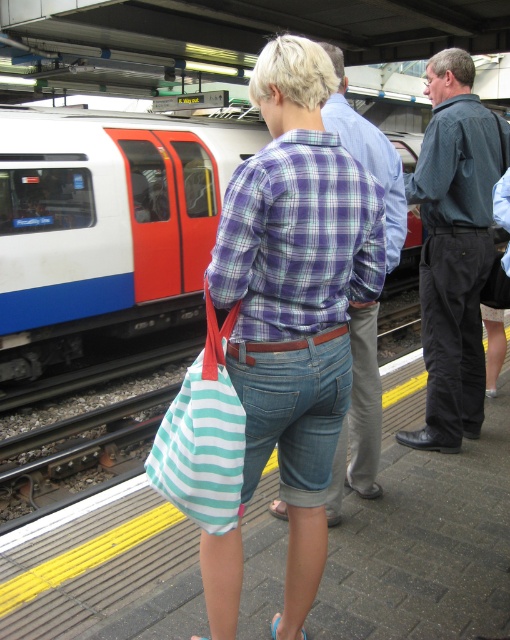
Can you confirm if dark blue shirt at center is positioned below teal striped fabric bag at center?

No, dark blue shirt at center is not below teal striped fabric bag at center.

Between dark blue shirt at center and teal striped fabric bag at center, which one has less height?

With less height is teal striped fabric bag at center.

Find the location of `dark blue shirt at center`. dark blue shirt at center is located at coordinates (454, 248).

Between point (107, 230) and point (344, 122), which one is positioned behind?

The point (107, 230) is behind.

Looking at this image, who is higher up, white glossy train at upper left or plaid shirt at center?

white glossy train at upper left is higher up.

Is point (67, 208) positioned before point (353, 452)?

No, it is not.

Locate an element on the screen. Image resolution: width=510 pixels, height=640 pixels. white glossy train at upper left is located at coordinates (105, 225).

The width and height of the screenshot is (510, 640). What do you see at coordinates (454, 248) in the screenshot? I see `dark blue shirt at center` at bounding box center [454, 248].

Where is `dark blue shirt at center`? dark blue shirt at center is located at coordinates (454, 248).